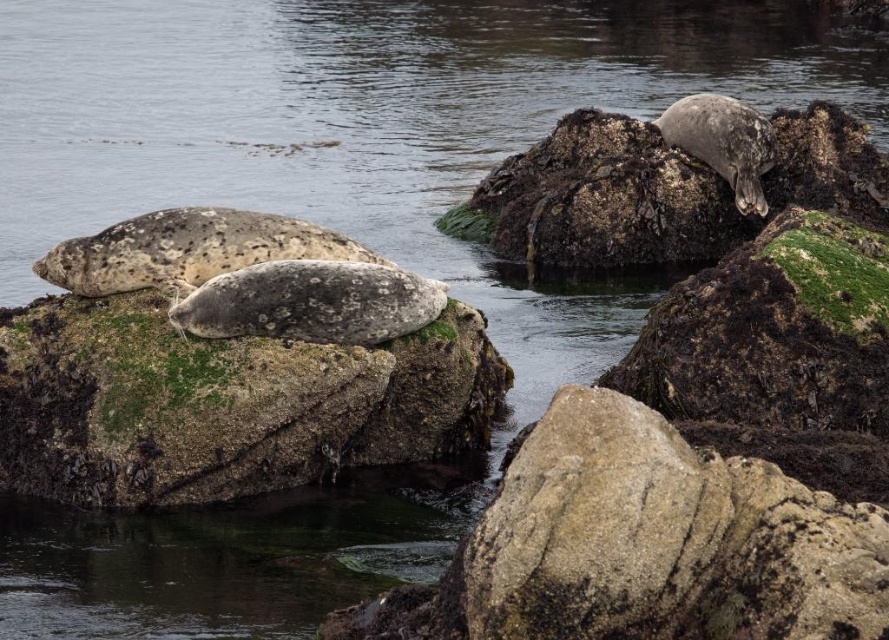
You are a photographer trying to capture the speckled fur seal at upper right. You notice the speckled gray rock at upper right might be blocking your view. Is the rock to the left or right of the seal?

The speckled gray rock at upper right is positioned on the left side of the speckled fur seal at upper right, so the rock is to the left of the seal.

You are a photographer positioned at the center of the scene. You want to capture a closeup of the speckled gray rock at upper right. Based on its 2D coordinates, in which direction should you move your camera to frame it properly?

The speckled gray rock at upper right is located at coordinates 0.300 on the x axis and 0.745 on the y axis. Since the photographer is at the center, they should move the camera to the left and upwards to frame the rock properly.